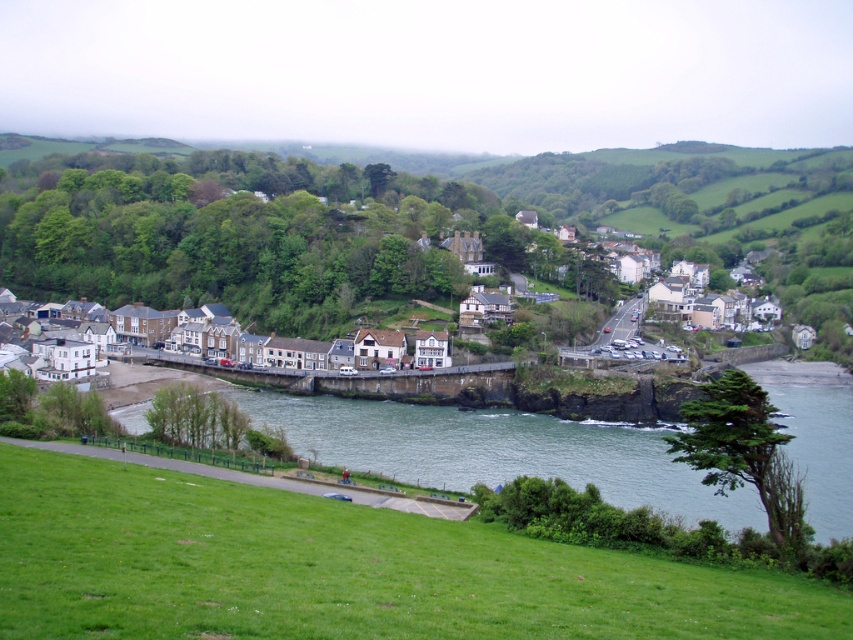
Question: Is green grassy at lower left wider than greenish-blue water at lower center?

Choices:
 (A) no
 (B) yes

Answer: (A)

Question: Which point is closer to the camera?

Choices:
 (A) greenish-blue water at lower center
 (B) green grassy at lower left

Answer: (B)

Question: Which point is farther to the camera?

Choices:
 (A) greenish-blue water at lower center
 (B) green grassy at lower left

Answer: (A)

Question: Is the position of green grassy at lower left more distant than that of greenish-blue water at lower center?

Choices:
 (A) no
 (B) yes

Answer: (A)

Question: Does green grassy at lower left have a smaller size compared to greenish-blue water at lower center?

Choices:
 (A) no
 (B) yes

Answer: (B)

Question: Which of the following is the farthest from the observer?

Choices:
 (A) (820, 541)
 (B) (138, 576)

Answer: (A)